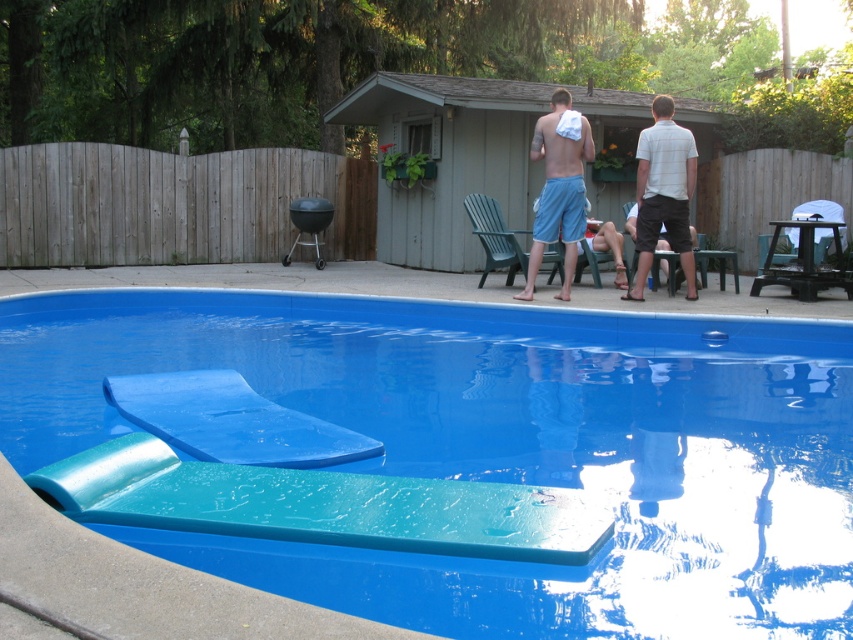
Between blue plastic slide at lower center and white checkered shirt at upper right, which one appears on the left side from the viewer's perspective?

blue plastic slide at lower center is more to the left.

Which is above, blue plastic slide at lower center or white checkered shirt at upper right?

Positioned higher is white checkered shirt at upper right.

What do you see at coordinates (231, 420) in the screenshot? Image resolution: width=853 pixels, height=640 pixels. I see `blue plastic slide at lower center` at bounding box center [231, 420].

Identify the location of blue plastic slide at lower center. (231, 420).

Can you confirm if matte blue shorts at upper center is bigger than white checkered shirt at upper right?

No, matte blue shorts at upper center is not bigger than white checkered shirt at upper right.

Is matte blue shorts at upper center thinner than white checkered shirt at upper right?

Yes.

Where is `matte blue shorts at upper center`? matte blue shorts at upper center is located at coordinates (664, 193).

The image size is (853, 640). Identify the location of matte blue shorts at upper center. (664, 193).

Who is positioned more to the right, blue rubber pool float at lower center or matte blue shorts at upper center?

From the viewer's perspective, matte blue shorts at upper center appears more on the right side.

Is the position of blue rubber pool float at lower center less distant than that of matte blue shorts at upper center?

Yes, it is in front of matte blue shorts at upper center.

Identify the location of blue rubber pool float at lower center. (495, 448).